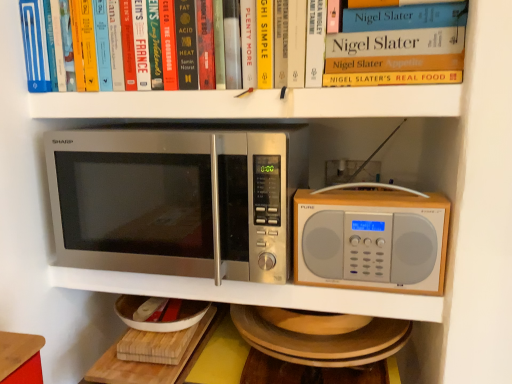
Question: Should I look upward or downward to see wooden cutting board at lower center?

Choices:
 (A) up
 (B) down

Answer: (B)

Question: Is silver metallic microwave at center, acting as the 2th microwave oven starting from the left, at the left side of hardcover book at upper center?

Choices:
 (A) yes
 (B) no

Answer: (B)

Question: From a real-world perspective, is silver metallic microwave at center, which is counted as the first microwave oven, starting from the right, located beneath hardcover book at upper center?

Choices:
 (A) yes
 (B) no

Answer: (A)

Question: Can you confirm if silver metallic microwave at center, which is counted as the first microwave oven, starting from the right, is taller than hardcover book at upper center?

Choices:
 (A) yes
 (B) no

Answer: (B)

Question: Can you confirm if silver metallic microwave at center, acting as the 2th microwave oven starting from the left, is thinner than hardcover book at upper center?

Choices:
 (A) yes
 (B) no

Answer: (A)

Question: From the image's perspective, is silver metallic microwave at center, which is counted as the first microwave oven, starting from the right, on hardcover book at upper center?

Choices:
 (A) yes
 (B) no

Answer: (B)

Question: Is silver metallic microwave at center, acting as the 2th microwave oven starting from the left, at the right side of hardcover book at upper center?

Choices:
 (A) yes
 (B) no

Answer: (A)

Question: Can you confirm if hardcover book at upper center is positioned to the right of stainless steel microwave at left, placed as the second microwave oven when sorted from right to left?

Choices:
 (A) no
 (B) yes

Answer: (B)

Question: Is hardcover book at upper center directly adjacent to stainless steel microwave at left, placed as the second microwave oven when sorted from right to left?

Choices:
 (A) yes
 (B) no

Answer: (B)

Question: Considering the relative sizes of hardcover book at upper center and stainless steel microwave at left, placed as the second microwave oven when sorted from right to left, in the image provided, is hardcover book at upper center shorter than stainless steel microwave at left, placed as the second microwave oven when sorted from right to left,?

Choices:
 (A) no
 (B) yes

Answer: (B)

Question: Considering the relative positions of hardcover book at upper center and stainless steel microwave at left, placed as the second microwave oven when sorted from right to left, in the image provided, is hardcover book at upper center behind stainless steel microwave at left, placed as the second microwave oven when sorted from right to left,?

Choices:
 (A) no
 (B) yes

Answer: (A)

Question: Is hardcover book at upper center outside of stainless steel microwave at left, placed as the second microwave oven when sorted from right to left?

Choices:
 (A) no
 (B) yes

Answer: (B)

Question: Is hardcover book at upper center at the left side of stainless steel microwave at left, placed as the second microwave oven when sorted from right to left?

Choices:
 (A) yes
 (B) no

Answer: (B)

Question: Does stainless steel microwave at left, placed as the second microwave oven when sorted from right to left, have a larger size compared to wooden cutting board at lower center?

Choices:
 (A) no
 (B) yes

Answer: (B)